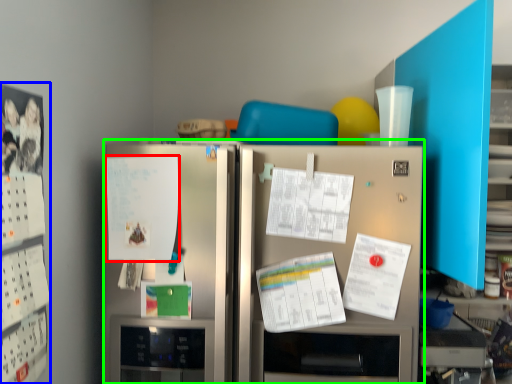
Question: Which object is positioned farthest from poster (highlighted by a red box)? Select from bulletin board (highlighted by a blue box) and refrigerator (highlighted by a green box).

Choices:
 (A) bulletin board
 (B) refrigerator

Answer: (A)